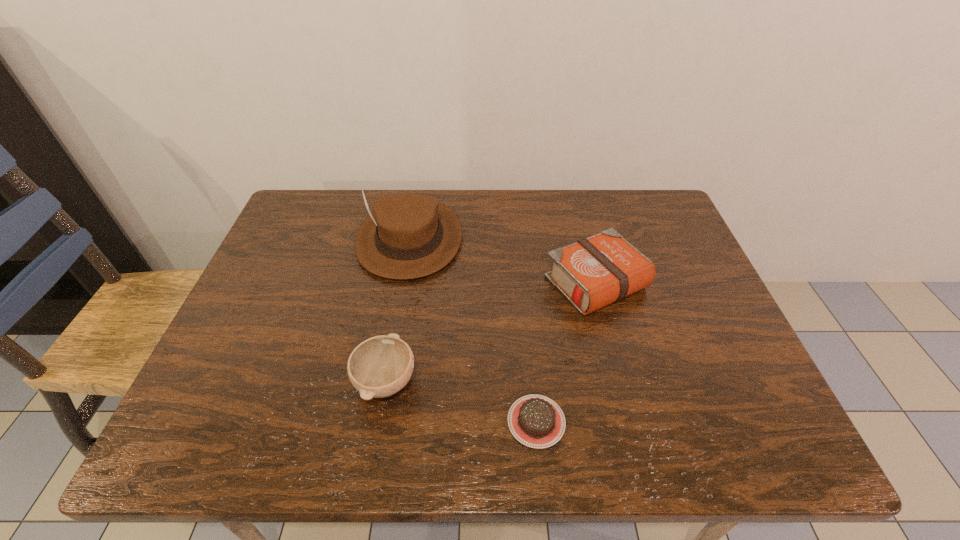
This screenshot has height=540, width=960. In order to click on bowl that is positioned at the near edge in this screenshot , I will do `click(380, 366)`.

Identify the location of chocolate cake that is positioned at the near edge. The height and width of the screenshot is (540, 960). (536, 421).

The image size is (960, 540). Identify the location of object located at the right edge. (593, 272).

The height and width of the screenshot is (540, 960). What are the coordinates of `free space at the far edge` in the screenshot? It's located at (500, 207).

This screenshot has height=540, width=960. I want to click on free space at the near edge of the desktop, so click(444, 453).

At what (x,y) coordinates should I click in order to perform the action: click on blank area at the left edge. Please return your answer as a coordinate pair (x, y). Looking at the image, I should click on (278, 262).

In the image, there is a desktop. Identify the location of free space at the right edge. This screenshot has width=960, height=540. (703, 409).

Image resolution: width=960 pixels, height=540 pixels. Find the location of `blank area at the far left corner`. blank area at the far left corner is located at coordinates (311, 230).

The height and width of the screenshot is (540, 960). Identify the location of vacant area at the near left corner of the desktop. (202, 453).

Image resolution: width=960 pixels, height=540 pixels. I want to click on free space that is in between the bowl and the Bible, so click(491, 332).